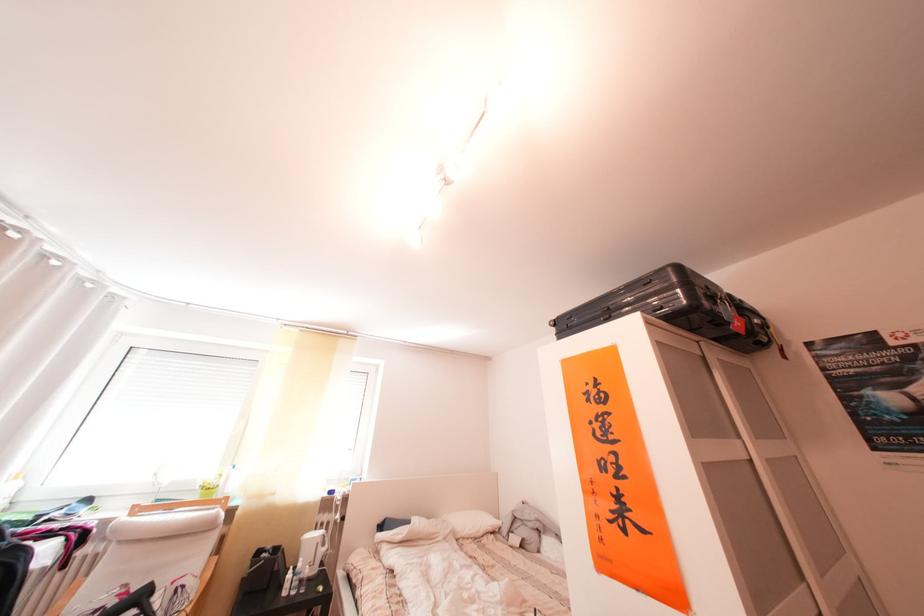
You are a GUI agent. You are given a task and a screenshot of the screen. Output one action in this format:
    pyautogui.click(x=<x>, y=<y>)
    Task: Click on the grey stuffed animal
    The width and height of the screenshot is (924, 616).
    Given the screenshot: What is the action you would take?
    pyautogui.click(x=528, y=527)